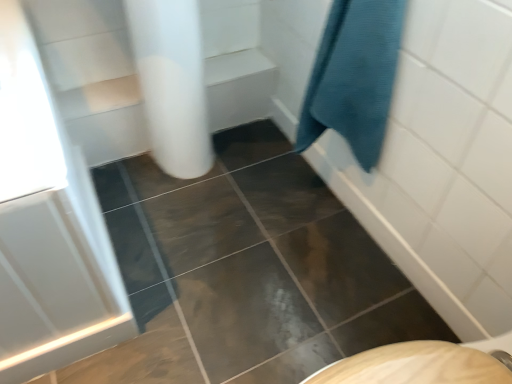
This screenshot has width=512, height=384. Describe the element at coordinates (354, 77) in the screenshot. I see `teal textured towel at upper right` at that location.

Where is `teal textured towel at upper right`? The image size is (512, 384). teal textured towel at upper right is located at coordinates (354, 77).

This screenshot has width=512, height=384. In order to click on teal textured towel at upper right in this screenshot , I will do `click(354, 77)`.